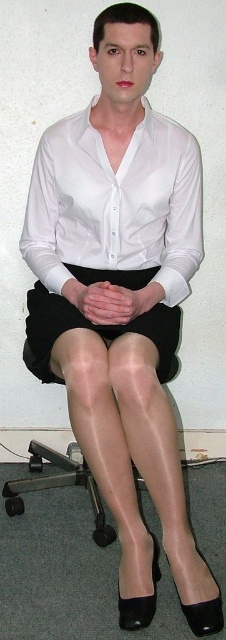
Question: Which point is farther from the camera taking this photo?

Choices:
 (A) (35, 232)
 (B) (39, 285)

Answer: (B)

Question: In this image, where is white satin shirt at center located relative to black tights at center?

Choices:
 (A) below
 (B) above

Answer: (B)

Question: Among these points, which one is nearest to the camera?

Choices:
 (A) (73, 150)
 (B) (47, 358)

Answer: (B)

Question: Is white satin shirt at center to the right of black tights at center from the viewer's perspective?

Choices:
 (A) yes
 (B) no

Answer: (A)

Question: Which point is closer to the camera?

Choices:
 (A) white satin shirt at center
 (B) black tights at center

Answer: (B)

Question: Does white satin shirt at center appear on the right side of black tights at center?

Choices:
 (A) yes
 (B) no

Answer: (A)